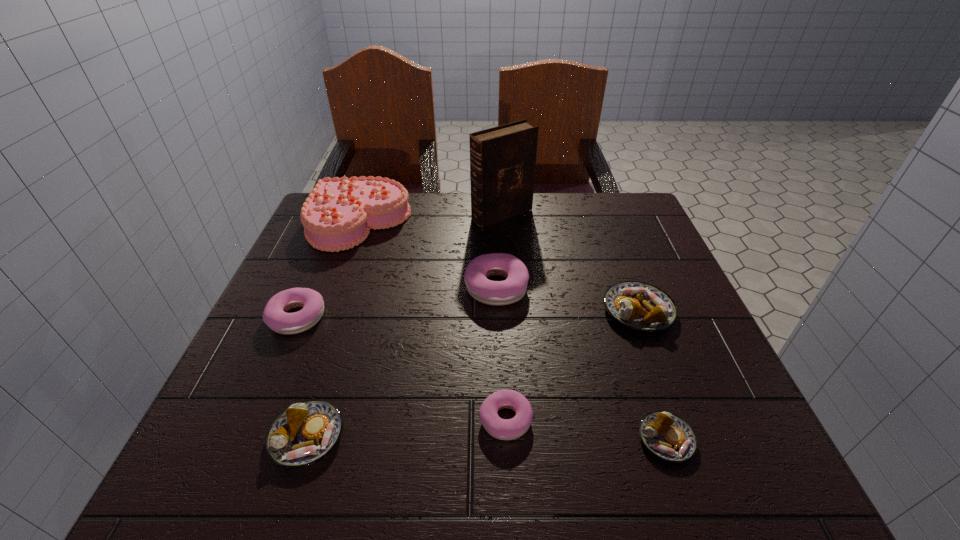
This screenshot has width=960, height=540. In order to click on free space located 0.200m on the left of the biggest pink pastry in this screenshot , I will do `click(376, 287)`.

At what (x,y) coordinates should I click in order to perform the action: click on vacant region located 0.080m on the front of the biggest brown pastry. Please return your answer as a coordinate pair (x, y). The width and height of the screenshot is (960, 540). Looking at the image, I should click on 660,370.

Locate an element on the screen. vacant region located 0.100m on the front of the leftmost pink pastry is located at coordinates (271, 380).

Identify the location of vacant region located on the right of the leftmost brown pastry. (478, 436).

This screenshot has height=540, width=960. Identify the location of vacant space located 0.400m on the left of the smallest pink pastry. (242, 420).

Find the location of a particular element. This screenshot has width=960, height=540. vacant space situated 0.170m on the left of the smallest brown pastry is located at coordinates click(x=534, y=439).

Locate an element on the screen. The image size is (960, 540). Bible present at the far edge is located at coordinates (502, 159).

The width and height of the screenshot is (960, 540). Identify the location of cake present at the far edge. (339, 213).

The width and height of the screenshot is (960, 540). Identify the location of cake that is at the left edge. (339, 213).

The width and height of the screenshot is (960, 540). I want to click on object present at the far left corner, so click(x=339, y=213).